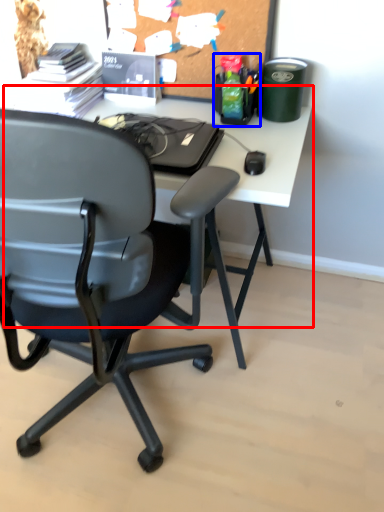
Question: Which point is closer to the camera, computer desk (highlighted by a red box) or stationery (highlighted by a blue box)?

Choices:
 (A) computer desk
 (B) stationery

Answer: (A)